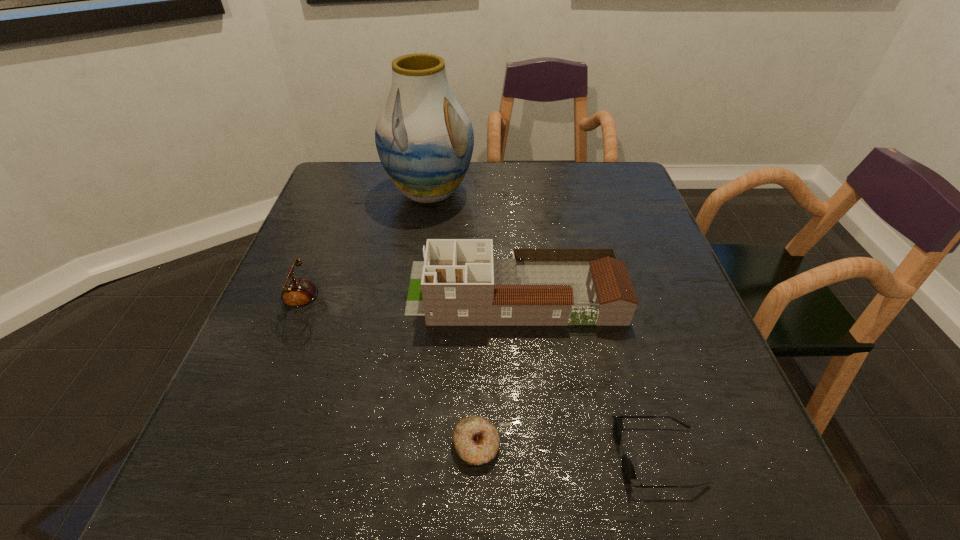
Where is `the tallest object`? The image size is (960, 540). the tallest object is located at coordinates (424, 138).

Locate an element on the screen. vase is located at coordinates (424, 138).

Locate an element on the screen. This screenshot has height=540, width=960. the second tallest object is located at coordinates (459, 283).

The width and height of the screenshot is (960, 540). Identify the location of the third tallest object. [297, 293].

Identify the location of the leftmost object. This screenshot has width=960, height=540. (297, 293).

At what (x,y) coordinates should I click in order to perform the action: click on the fourth tallest object. Please return your answer as a coordinate pair (x, y). The height and width of the screenshot is (540, 960). Looking at the image, I should click on (628, 470).

This screenshot has height=540, width=960. Identify the location of the shortest object. (476, 440).

I want to click on free space located 0.170m on the left of the vase, so click(326, 192).

Identify the location of free location located 0.120m at the main entrance of the dollhouse. click(355, 292).

I want to click on free space located at the main entrance of the dollhouse, so pyautogui.click(x=333, y=292).